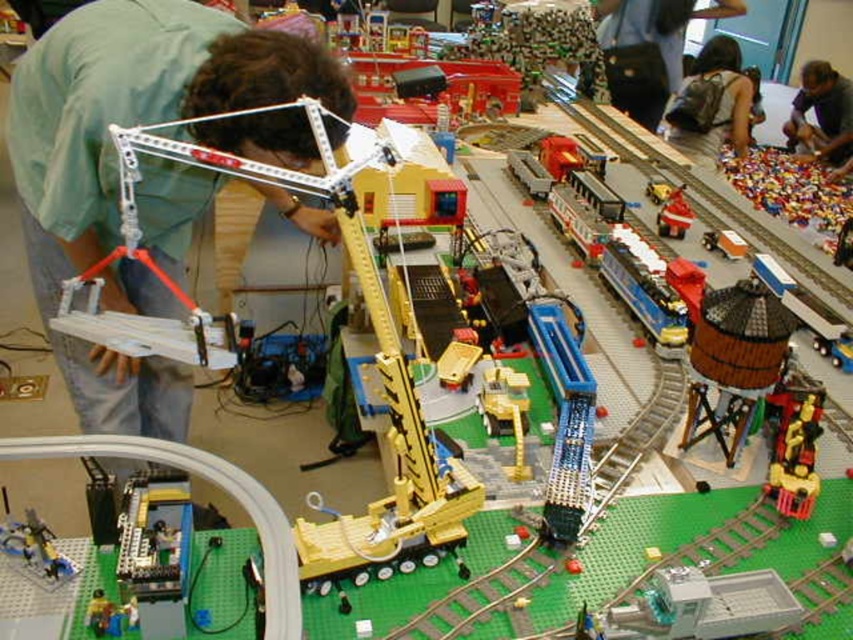
Question: Considering the real-world distances, which object is closest to the green matte shirt at upper left?

Choices:
 (A) dark blue backpack at upper right
 (B) yellow plastic crane at center
 (C) dark blue shirt at upper right

Answer: (B)

Question: Does green matte shirt at upper left appear on the right side of red matte train at center?

Choices:
 (A) yes
 (B) no

Answer: (B)

Question: Which is farther from the dark blue backpack at upper right?

Choices:
 (A) dark blue shirt at upper right
 (B) green matte shirt at upper left

Answer: (B)

Question: Does dark blue backpack at upper right appear under dark brown backpack at upper right?

Choices:
 (A) yes
 (B) no

Answer: (B)

Question: Which point is closer to the camera?

Choices:
 (A) (728, 122)
 (B) (624, 35)
 (C) (401, 461)

Answer: (C)

Question: Is yellow plastic crane at center closer to the viewer compared to dark brown backpack at upper right?

Choices:
 (A) yes
 (B) no

Answer: (A)